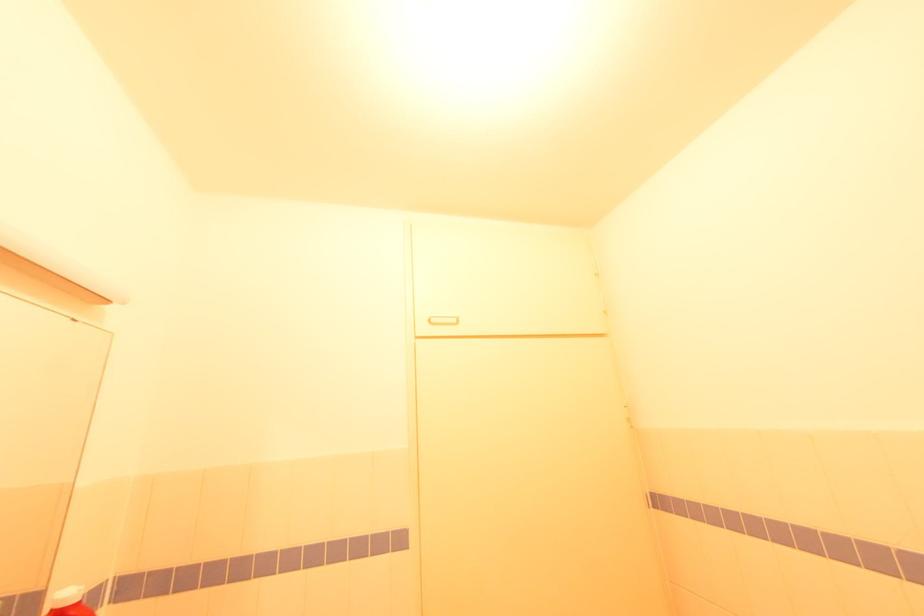
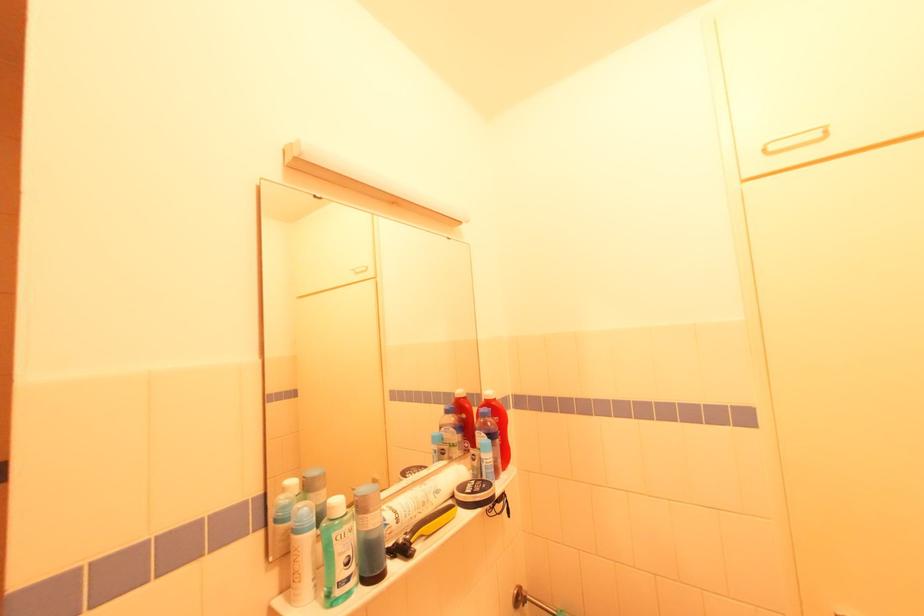
Question: The camera is either moving clockwise (left) or counter-clockwise (right) around the object. The first image is from the beginning of the video and the second image is from the end. Is the camera moving left or right when shooting the video?

Choices:
 (A) Left
 (B) Right

Answer: (B)